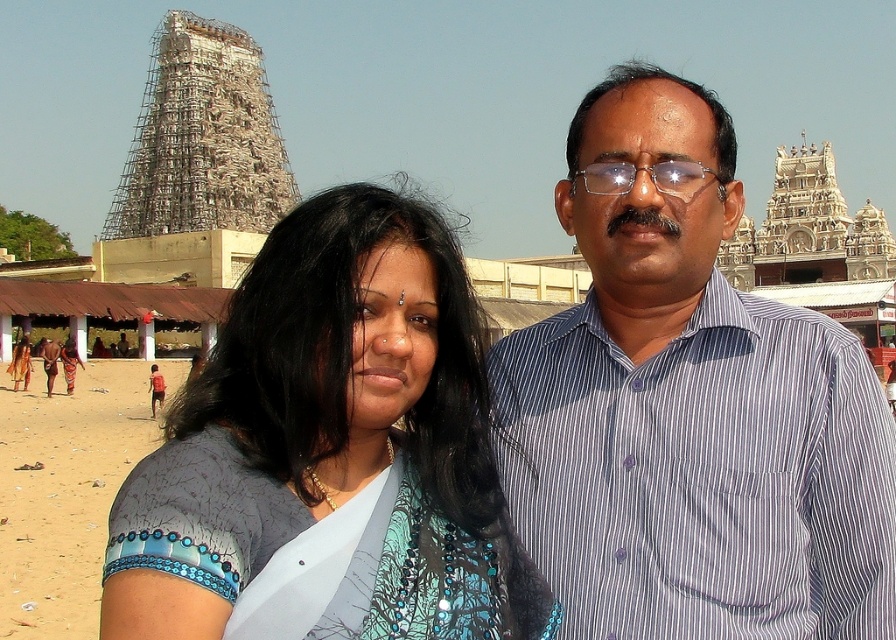
How far apart are blue printed saree at center and blue fabric at lower left?

The distance of blue printed saree at center from blue fabric at lower left is 29.67 meters.

Is blue printed saree at center above blue fabric at lower left?

Yes, blue printed saree at center is above blue fabric at lower left.

Locate an element on the screen. The height and width of the screenshot is (640, 896). blue printed saree at center is located at coordinates (332, 451).

Locate an element on the screen. blue printed saree at center is located at coordinates (332, 451).

Which is more to the right, blue striped shirt at center or blue fabric at lower left?

blue striped shirt at center is more to the right.

Does blue striped shirt at center appear under blue fabric at lower left?

Actually, blue striped shirt at center is above blue fabric at lower left.

Identify the location of blue striped shirt at center. (688, 406).

Which is behind, point (738, 589) or point (362, 528)?

The point (738, 589) is behind.

I want to click on blue striped shirt at center, so click(688, 406).

What do you see at coordinates (688, 406) in the screenshot?
I see `blue striped shirt at center` at bounding box center [688, 406].

Locate an element on the screen. blue striped shirt at center is located at coordinates (688, 406).